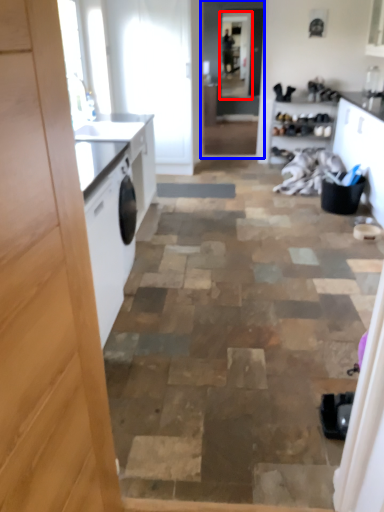
Question: Which object is further to the camera taking this photo, screen door (highlighted by a red box) or screen door (highlighted by a blue box)?

Choices:
 (A) screen door
 (B) screen door

Answer: (A)